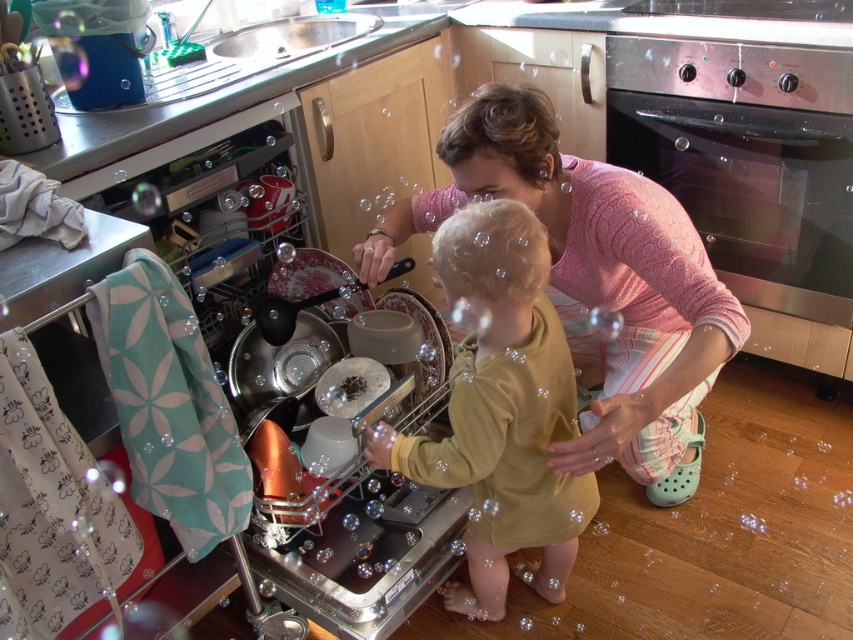
You are organizing a kitchen layout and need to place the pink textured sweater at center and the metallic silver dish washer at left. Considering their widths, which object requires more horizontal space?

The pink textured sweater at center requires more horizontal space because its width surpasses that of the metallic silver dish washer at left.

You are standing in the kitchen and want to reach both the point at coordinates point (811, 234) and point (177, 141). Which point is closer to you?

Point (177, 141) is closer to you because it is less further away than point (811, 234).

What is located at the point with coordinates [595,284] in the image?

The point at coordinates [595,284] marks the location of the pink textured sweater at center.